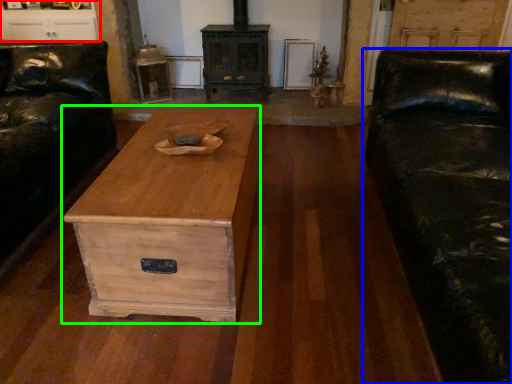
Question: Considering the real-world distances, which object is farthest from entertainment center (highlighted by a red box)? studio couch (highlighted by a blue box) or chest of drawers (highlighted by a green box)?

Choices:
 (A) studio couch
 (B) chest of drawers

Answer: (A)